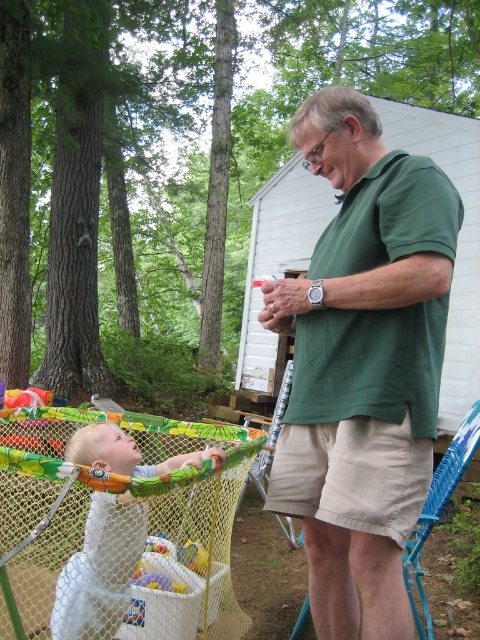
Does point (109, 593) come farther from viewer compared to point (180, 556)?

That is False.

Is point (117, 560) in front of point (192, 545)?

Yes, it is in front of point (192, 545).

The width and height of the screenshot is (480, 640). What are the coordinates of `white mesh baby at center` in the screenshot? It's located at (100, 570).

Which is in front, point (288, 492) or point (84, 632)?

Point (288, 492)

Who is higher up, green cotton shirt at center or white mesh baby at center?

Positioned higher is green cotton shirt at center.

Where is `green cotton shirt at center`? green cotton shirt at center is located at coordinates (362, 364).

Who is positioned more to the left, green cotton shirt at center or plastic yellow ball at center?

plastic yellow ball at center

Is point (357, 419) positioned in front of point (199, 556)?

That is True.

The height and width of the screenshot is (640, 480). I want to click on green cotton shirt at center, so click(362, 364).